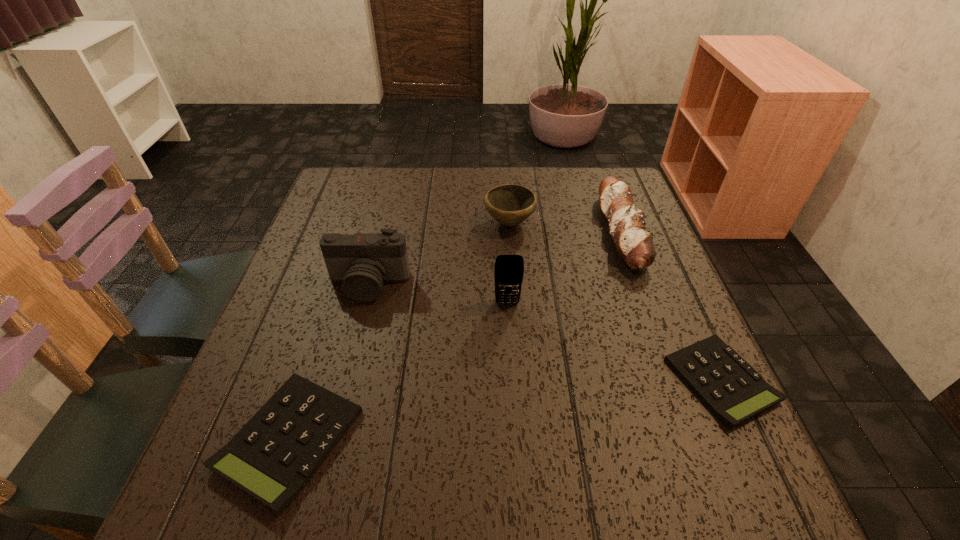
The image size is (960, 540). What are the coordinates of `vacant area located on the front of the bowl` in the screenshot? It's located at (515, 282).

The image size is (960, 540). Identify the location of vacant space located 0.280m on the left of the baguet. (495, 231).

You are a GUI agent. You are given a task and a screenshot of the screen. Output one action in this format:
    pyautogui.click(x=<x>, y=<y>)
    Task: Click on the vacant space situated 0.310m at the lens of the camera
    
    Given the screenshot: What is the action you would take?
    pyautogui.click(x=329, y=437)

You are a GUI agent. You are given a task and a screenshot of the screen. Output one action in this format:
    pyautogui.click(x=<x>, y=<y>)
    Task: Click on the free space located 0.180m on the screen of the cellular telephone
    The height and width of the screenshot is (540, 960).
    Given the screenshot: What is the action you would take?
    pyautogui.click(x=512, y=379)

Locate an element on the screen. This screenshot has height=540, width=960. bowl that is at the far edge is located at coordinates (510, 204).

Find the location of `baguet that is at the far edge`. baguet that is at the far edge is located at coordinates (626, 223).

Where is `calculator at the left edge`? The image size is (960, 540). calculator at the left edge is located at coordinates (276, 453).

In order to click on camera that is at the left edge in this screenshot , I will do `click(362, 262)`.

Where is `calculator situated at the right edge`? The height and width of the screenshot is (540, 960). calculator situated at the right edge is located at coordinates (730, 387).

Where is `baguet that is at the right edge`? This screenshot has height=540, width=960. baguet that is at the right edge is located at coordinates (626, 223).